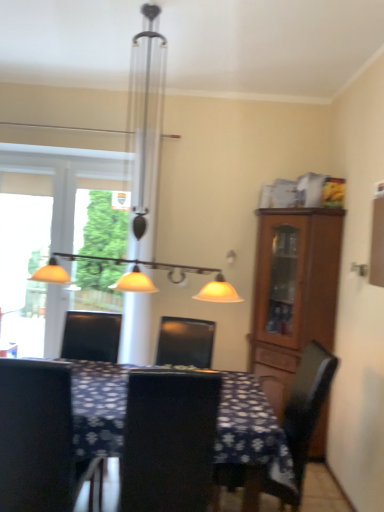
Question: Is brown wooden cabinet at right at the left side of dark blue fabric table at center?

Choices:
 (A) no
 (B) yes

Answer: (A)

Question: Is brown wooden cabinet at right located outside dark blue fabric table at center?

Choices:
 (A) yes
 (B) no

Answer: (A)

Question: Would you say dark blue fabric table at center is part of brown wooden cabinet at right's contents?

Choices:
 (A) yes
 (B) no

Answer: (B)

Question: Does brown wooden cabinet at right have a lesser height compared to dark blue fabric table at center?

Choices:
 (A) no
 (B) yes

Answer: (A)

Question: From the image's perspective, is brown wooden cabinet at right on top of dark blue fabric table at center?

Choices:
 (A) no
 (B) yes

Answer: (B)

Question: In terms of size, does black leather chair at center, which appears as the 2th chair when viewed from the right, appear bigger or smaller than transparent glass window at left?

Choices:
 (A) big
 (B) small

Answer: (A)

Question: Is black leather chair at center, which appears as the 2th chair when viewed from the right, taller or shorter than transparent glass window at left?

Choices:
 (A) short
 (B) tall

Answer: (A)

Question: Based on their positions, is black leather chair at center, the second chair viewed from the left, located to the left or right of transparent glass window at left?

Choices:
 (A) left
 (B) right

Answer: (B)

Question: Considering the positions of black leather chair at center, which appears as the 2th chair when viewed from the right, and transparent glass window at left in the image, is black leather chair at center, which appears as the 2th chair when viewed from the right, wider or thinner than transparent glass window at left?

Choices:
 (A) wide
 (B) thin

Answer: (A)

Question: Does point (125, 462) appear closer or farther from the camera than point (309, 256)?

Choices:
 (A) farther
 (B) closer

Answer: (B)

Question: Looking at the image, does black leather chair at center, the second chair viewed from the left, seem bigger or smaller compared to brown wooden cabinet at right?

Choices:
 (A) big
 (B) small

Answer: (B)

Question: Would you say black leather chair at center, the second chair viewed from the left, is to the left or to the right of brown wooden cabinet at right in the picture?

Choices:
 (A) right
 (B) left

Answer: (B)

Question: Relative to brown wooden cabinet at right, is black leather chair at center, the second chair viewed from the left, in front or behind?

Choices:
 (A) front
 (B) behind

Answer: (A)

Question: Based on their sizes in the image, would you say transparent glass window at left is bigger or smaller than matte metal chandelier at upper center?

Choices:
 (A) big
 (B) small

Answer: (B)

Question: Does point (34, 345) appear closer or farther from the camera than point (158, 12)?

Choices:
 (A) farther
 (B) closer

Answer: (A)